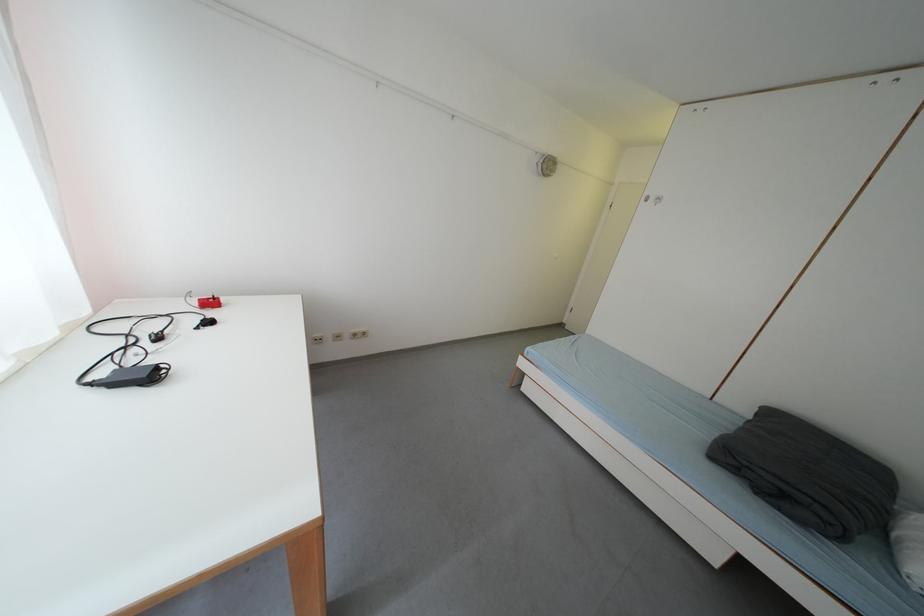
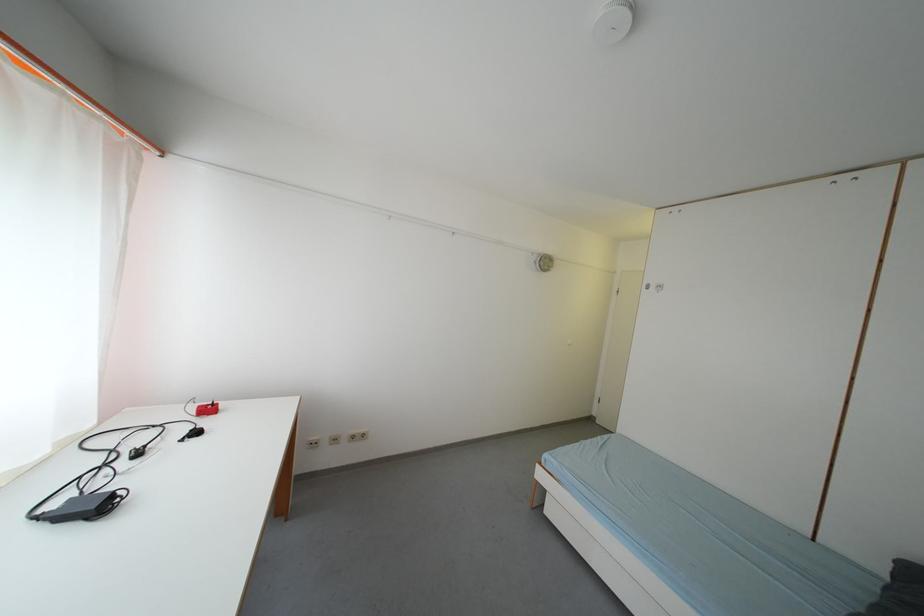
The point at (205, 309) is marked in the first image. Where is the corresponding point in the second image?

(202, 416)